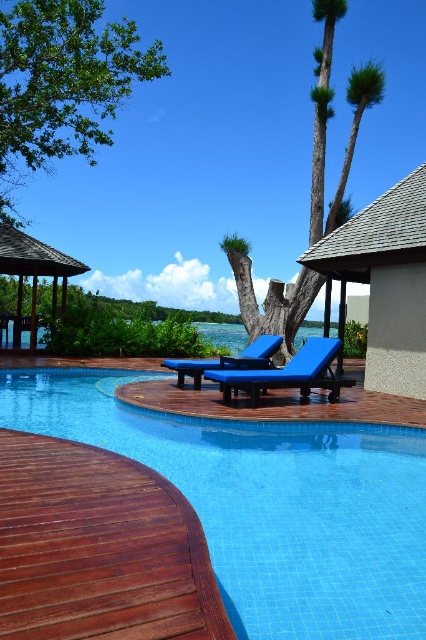
You are standing at the center of the wooden deck and want to walk directly to the blue tile swimming pool at center. Which direction should you walk?

Since the blue tile swimming pool at center is located at point (267, 502), you should walk towards the direction of the coordinates to reach it.

You are planning to sunbathe on the blue fabric chaise lounge at center. However, you want to ensure that the lounge is not directly over the blue tile swimming pool at center to avoid splashing water. Is the lounge positioned over the pool?

The blue tile swimming pool at center is positioned under the blue fabric chaise lounge at center, meaning the lounge is directly over the pool. This placement would likely result in splashing water, so it might not be ideal for sunbathing without getting wet.